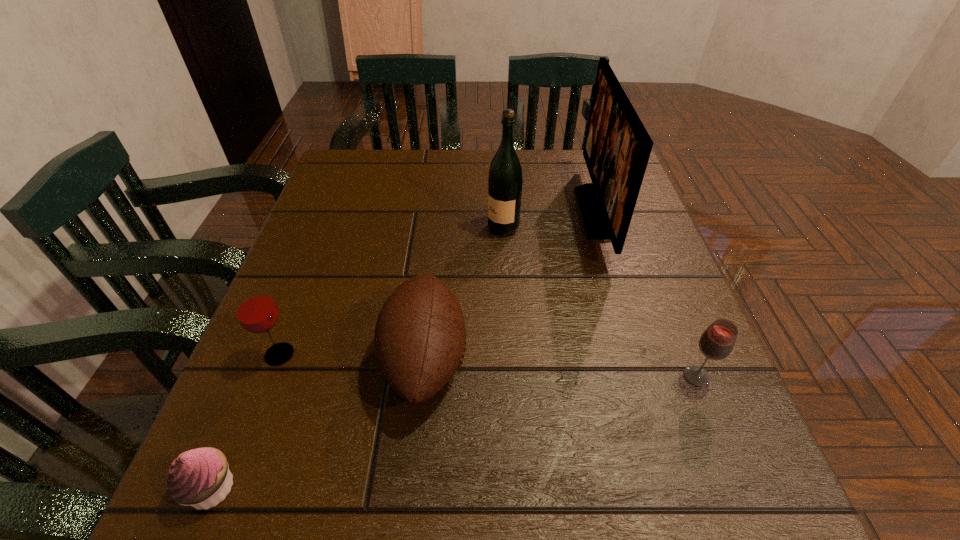
Find the location of a particular element. The height and width of the screenshot is (540, 960). free spot between the monitor and the third object from right to left is located at coordinates (550, 220).

Identify the location of vacant area that lies between the shortest object and the left glass drink container. (246, 421).

Find the location of a particular element. vacant space that is in between the shortest object and the rightmost object is located at coordinates (454, 432).

At what (x,y) coordinates should I click in order to perform the action: click on vacant space in between the second object from right to left and the fourth object from left to right. Please return your answer as a coordinate pair (x, y). The height and width of the screenshot is (540, 960). Looking at the image, I should click on (550, 220).

At what (x,y) coordinates should I click in order to perform the action: click on free space between the monitor and the fourth object from right to left. Please return your answer as a coordinate pair (x, y). This screenshot has height=540, width=960. Looking at the image, I should click on (511, 286).

The width and height of the screenshot is (960, 540). I want to click on vacant area that lies between the left glass drink container and the right glass drink container, so click(x=488, y=366).

Find the location of `vacant region between the nearest object and the rightmost object`. vacant region between the nearest object and the rightmost object is located at coordinates 454,432.

This screenshot has width=960, height=540. I want to click on vacant point located between the fourth object from right to left and the monitor, so click(x=511, y=286).

Image resolution: width=960 pixels, height=540 pixels. Identify the location of free spot between the second object from right to left and the third object from left to right. (511, 286).

Locate which object ranks third in proximity to the taller glass drink container. Please provide its 2D coordinates. Your answer should be formatted as a tuple, i.e. [(x, y)], where the tuple contains the x and y coordinates of a point satisfying the conditions above.

[(505, 179)]